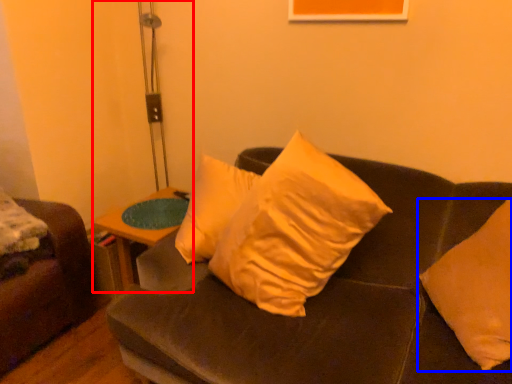
Question: Among these objects, which one is nearest to the camera, table lamp (highlighted by a red box) or pillow (highlighted by a blue box)?

Choices:
 (A) table lamp
 (B) pillow

Answer: (B)